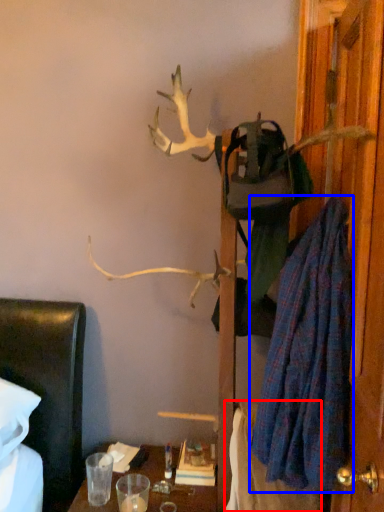
Question: Which of the following is the farthest to the observer, blanket (highlighted by a red box) or robe (highlighted by a blue box)?

Choices:
 (A) blanket
 (B) robe

Answer: (A)